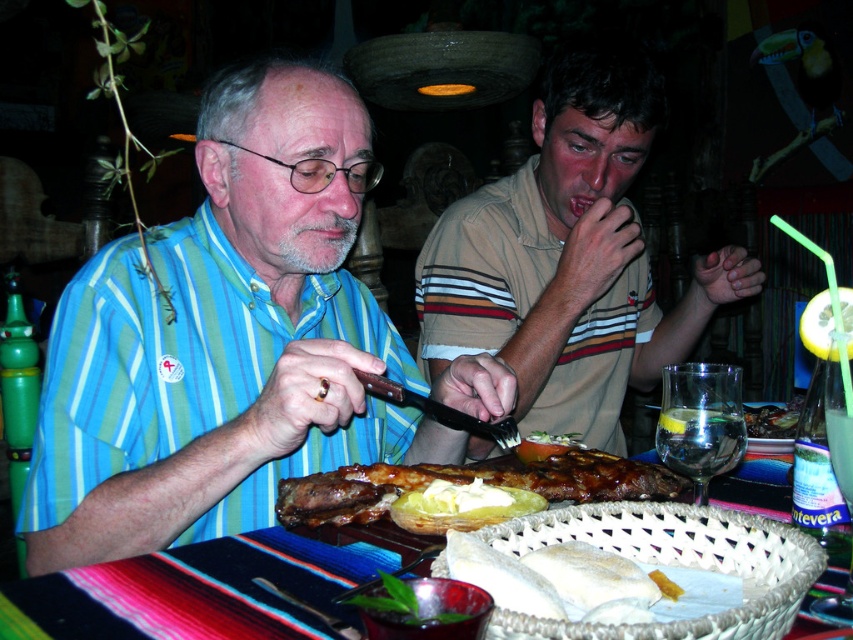
Question: Which is nearer to the yellow buttery potato at center?

Choices:
 (A) golden brown ribs at center
 (B) blue striped shirt at center

Answer: (A)

Question: Which object appears farthest from the camera in this image?

Choices:
 (A) white doughy bread at center
 (B) brown striped shirt at center
 (C) golden brown ribs at center
 (D) wooden table at center

Answer: (B)

Question: Is blue striped shirt at center behind golden brown ribs at center?

Choices:
 (A) yes
 (B) no

Answer: (A)

Question: Is golden brown ribs at center positioned behind white doughy bread at center?

Choices:
 (A) yes
 (B) no

Answer: (A)

Question: Is brown striped shirt at center to the left of yellow buttery potato at center from the viewer's perspective?

Choices:
 (A) yes
 (B) no

Answer: (B)

Question: Which point is farther to the camera?

Choices:
 (A) wooden table at center
 (B) blue striped shirt at center
 (C) brown striped shirt at center
 (D) white doughy bread at center

Answer: (C)